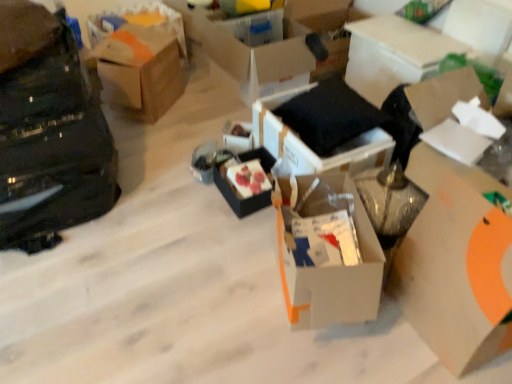
Question: Is black matte bag at left in front of white cardboard box at center, the fifth box positioned from the right?

Choices:
 (A) no
 (B) yes

Answer: (A)

Question: Does black matte bag at left have a lesser width compared to white cardboard box at center, which ranks as the fourth box in left-to-right order?

Choices:
 (A) no
 (B) yes

Answer: (A)

Question: From a real-world perspective, does black matte bag at left sit lower than white cardboard box at center, which ranks as the fourth box in left-to-right order?

Choices:
 (A) yes
 (B) no

Answer: (B)

Question: Considering the relative sizes of black matte bag at left and white cardboard box at center, the fifth box positioned from the right, in the image provided, is black matte bag at left wider than white cardboard box at center, the fifth box positioned from the right,?

Choices:
 (A) no
 (B) yes

Answer: (B)

Question: Is black matte bag at left located outside white cardboard box at center, the fifth box positioned from the right?

Choices:
 (A) yes
 (B) no

Answer: (A)

Question: Based on their positions, is white cardboard box at right, the third box in the right-to-left sequence, located to the left or right of brown cardboard box at upper left, arranged as the eighth box when viewed from the right?

Choices:
 (A) right
 (B) left

Answer: (A)

Question: Relative to brown cardboard box at upper left, arranged as the eighth box when viewed from the right, is white cardboard box at right, the third box in the right-to-left sequence, in front or behind?

Choices:
 (A) behind
 (B) front

Answer: (B)

Question: From a real-world perspective, relative to brown cardboard box at upper left, arranged as the eighth box when viewed from the right, is white cardboard box at right, acting as the sixth box starting from the left, vertically above or below?

Choices:
 (A) below
 (B) above

Answer: (B)

Question: Looking at the image, does white cardboard box at right, the third box in the right-to-left sequence, seem bigger or smaller compared to brown cardboard box at upper left, arranged as the eighth box when viewed from the right?

Choices:
 (A) small
 (B) big

Answer: (A)

Question: From the image's perspective, is white cardboard box at upper center, placed as the sixth box when sorted from right to left, located above or below white cardboard box at upper center, the second box viewed from the right?

Choices:
 (A) below
 (B) above

Answer: (B)

Question: Looking at the image, does white cardboard box at upper center, which is the 3th box in left-to-right order, seem bigger or smaller compared to white cardboard box at upper center, the second box viewed from the right?

Choices:
 (A) small
 (B) big

Answer: (B)

Question: From a real-world perspective, is white cardboard box at upper center, which is the 3th box in left-to-right order, physically located above or below white cardboard box at upper center, the second box viewed from the right?

Choices:
 (A) above
 (B) below

Answer: (B)

Question: Relative to white cardboard box at upper center, the second box viewed from the right, is white cardboard box at upper center, which is the 3th box in left-to-right order, in front or behind?

Choices:
 (A) behind
 (B) front

Answer: (A)

Question: Considering the positions of brown cardboard box at upper left, positioned as the first box in left-to-right order, and black fabric cushion at center, which is the fifth box in left-to-right order, in the image, is brown cardboard box at upper left, positioned as the first box in left-to-right order, bigger or smaller than black fabric cushion at center, which is the fifth box in left-to-right order,?

Choices:
 (A) small
 (B) big

Answer: (B)

Question: From the image's perspective, is brown cardboard box at upper left, positioned as the first box in left-to-right order, above or below black fabric cushion at center, which is the fifth box in left-to-right order?

Choices:
 (A) below
 (B) above

Answer: (B)